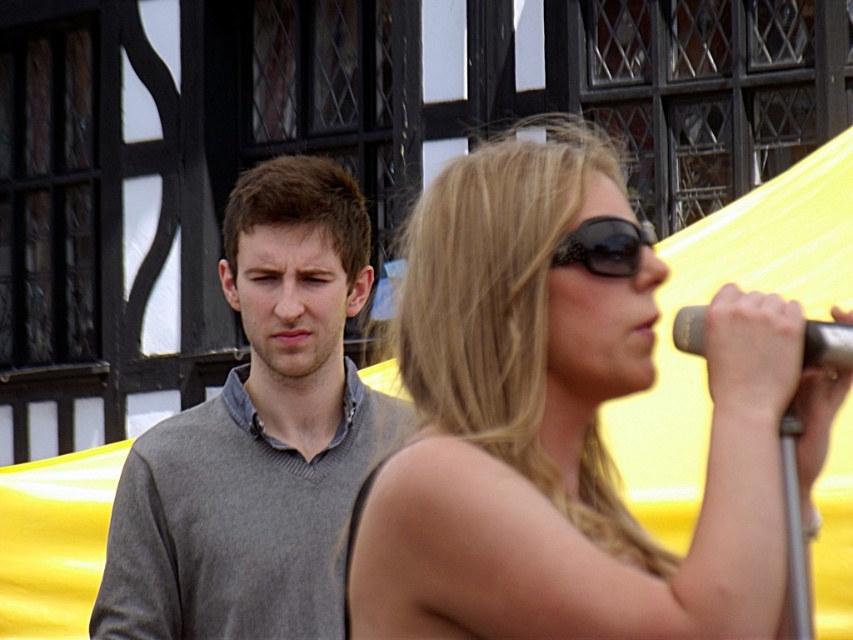
You are standing in the outdoor setting shown. There are two points of interest marked as point 1 at coordinates point (161, 422) and point 2 at coordinates point (838, 365). Which point is closer to you?

Point (161, 422) is closer to you because it is further to the viewer than point (838, 365).

You are standing in the same location as the person wearing the gray wool sweater at left. If you look directly ahead, which object from the scene would be in your line of sight?

The gray wool sweater at left is located at point (259,435), so if you were standing there and looked directly ahead, you would be facing the woman with sunglasses holding a microphone on the right side of the frame.